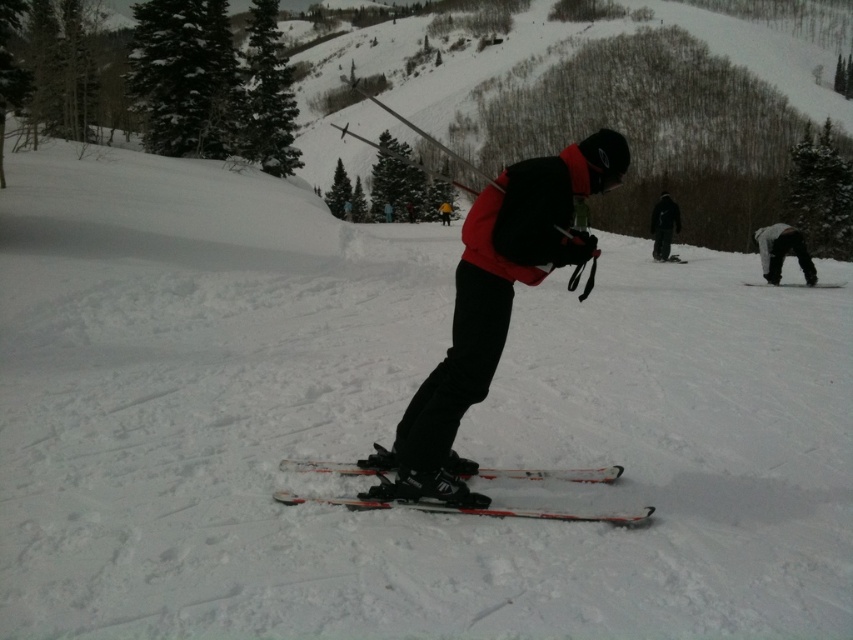
You are a photographer at the ski resort and want to capture both the matte black ski suit at center and the white matte ski at lower right in a single frame. Which object should you focus on first to ensure both are in the frame?

You should focus on the matte black ski suit at center first because it is larger than the white matte ski at lower right, ensuring it fits within the frame while allowing space for the smaller object.